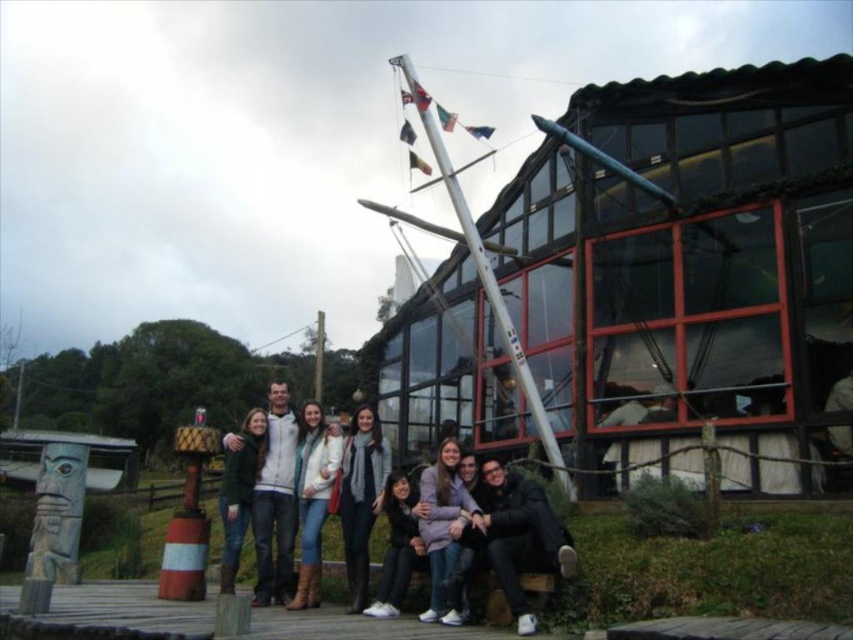
You are a photographer standing 5 meters away from the group. You want to take a closeup shot of the white fleece jacket at center and the knitted scarf at center. Can you frame both in the same photo without moving your position?

The white fleece jacket at center and knitted scarf at center are 4.81 meters apart from each other. Since you are 5 meters away from the group, the distance between the two objects is slightly less than your distance from them. This means it is possible to frame both in the same photo without moving your position, as they are within the camera lens field of view at that distance.

You are standing at the center of the wooden platform. Looking at the white wooden mast at center, where is it located in relation to your position?

The white wooden mast at center is located at point 0.430 on the x axis and 0.570 on the y axis relative to the center of the wooden platform.

You are a photographer trying to capture a closeup of the knitted scarf at center. However, the white fleece jacket at center is blocking your view. Can you adjust your angle to see the scarf without moving the subjects?

The white fleece jacket at center is positioned over the knitted scarf at center, so adjusting your angle might allow you to see the scarf underneath if you tilt the camera slightly downward or move to the side to avoid the jacket blocking the view.